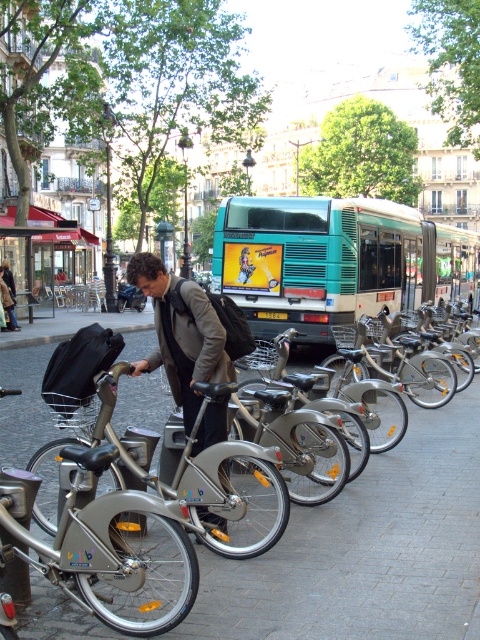
You are a delivery person who needs to place a package on the matte gray jacket at center and the black fabric bag at lower left. Which one can you place the package on top of?

The matte gray jacket at center has a greater height compared to the black fabric bag at lower left, so the package can be placed on top of the matte gray jacket at center.

You are a tourist in Paris and see the silver metallic bicycle at center and the matte gray jacket at center. Which object is taller?

The silver metallic bicycle at center is taller than the matte gray jacket at center.

You are standing on the cobblestone sidewalk in front of the silver Velib bicycles. You want to take a photo of the teal matte bus at center without moving any bicycles. Is there a clear line of sight to the bus?

Yes, there is a clear line of sight to the teal matte bus at center because the bicycles are parked neatly along the sidewalk and the bus is positioned centrally in the scene, allowing an unobstructed view.